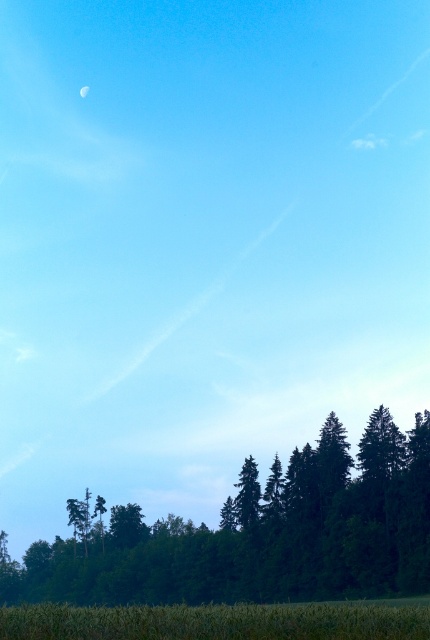
You are standing at the bottom of the image and want to walk towards the green grass at bottom. Which direction should you look to see the green matte tree at lower center?

The green matte tree at lower center is to the left of green grass at bottom, so you should look to your left to see it.

You are a small bird looking for a place to land. You see the green matte tree at lower center and the green grass at bottom. Which one is taller?

The green matte tree at lower center is taller than the green grass at bottom.

You are standing in the landscape scene and want to place a small flag at both point (x=150, y=532) and point (x=172, y=609). Which point is closer to you where you can plant the flag without needing to walk further away?

Point (x=150, y=532) is closer to you than point (x=172, y=609) because it is further to the camera, meaning it is physically nearer to your position in the scene.